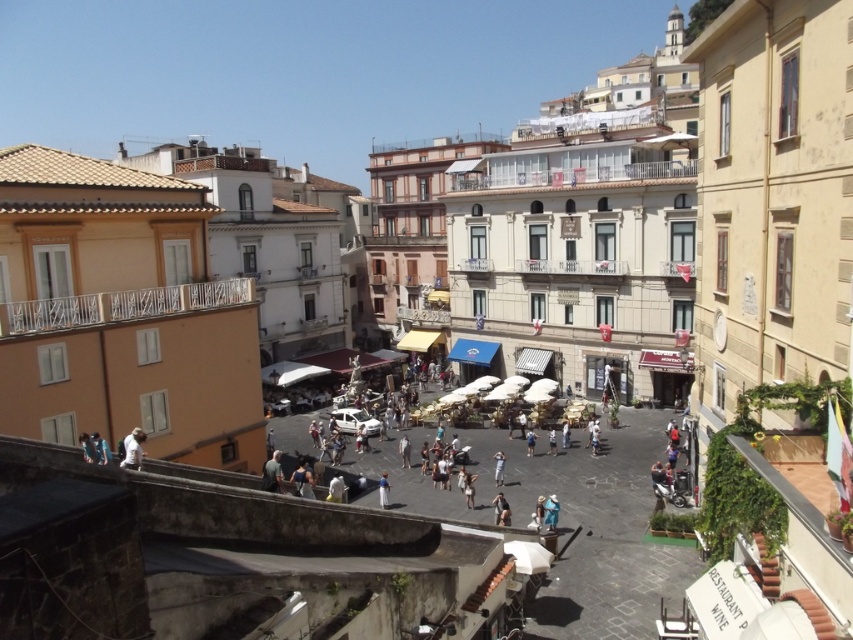
Does blue fabric shirt at center have a lesser height compared to white cotton shirt at center?

Yes, blue fabric shirt at center is shorter than white cotton shirt at center.

Does blue fabric shirt at center have a greater height compared to white cotton shirt at center?

No, blue fabric shirt at center is not taller than white cotton shirt at center.

Find the location of a particular element. blue fabric shirt at center is located at coordinates (383, 490).

Does white fabric shirt at lower left appear on the right side of blue fabric shirt at center?

No, white fabric shirt at lower left is not to the right of blue fabric shirt at center.

Between white fabric shirt at lower left and blue fabric shirt at center, which one appears on the left side from the viewer's perspective?

Positioned to the left is white fabric shirt at lower left.

Identify the location of white fabric shirt at lower left. The image size is (853, 640). (132, 449).

Between dark gray fabric jacket at lower left and dark gray fabric bag at center, which one is positioned lower?

dark gray fabric bag at center

Is point (279, 452) in front of point (505, 522)?

That is False.

Locate an element on the screen. Image resolution: width=853 pixels, height=640 pixels. dark gray fabric jacket at lower left is located at coordinates (271, 474).